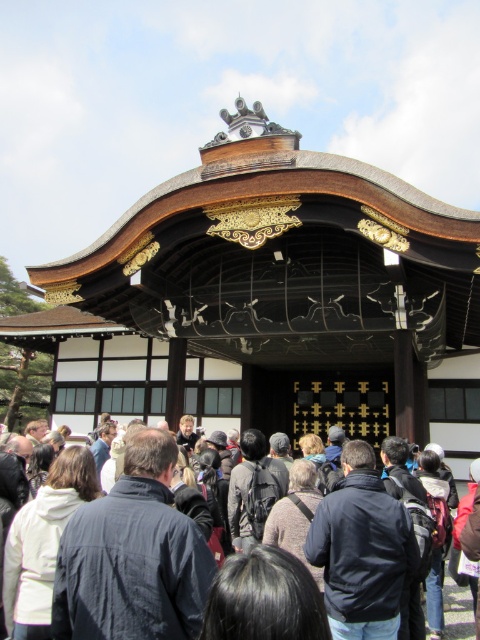
Which is more to the right, dark gray backpack at center or dark blue fabric backpack at center?

dark blue fabric backpack at center

Is point (255, 448) less distant than point (468, 540)?

No, (255, 448) is behind (468, 540).

What do you see at coordinates (252, 490) in the screenshot? I see `dark gray backpack at center` at bounding box center [252, 490].

You are a GUI agent. You are given a task and a screenshot of the screen. Output one action in this format:
    pyautogui.click(x=<x>, y=<y>)
    Task: Click on the dark gray backpack at center
    This screenshot has height=640, width=480.
    Given the screenshot: What is the action you would take?
    pyautogui.click(x=252, y=490)

Consider the image. Who is more distant from viewer, (63, 520) or (477, 529)?

The point (477, 529) is more distant.

Is white fleece jacket at lower left positioned behind dark blue fabric backpack at center?

No, white fleece jacket at lower left is closer to the viewer.

Locate an element on the screen. The height and width of the screenshot is (640, 480). white fleece jacket at lower left is located at coordinates (43, 541).

Is point (181, 588) positioned before point (307, 518)?

Yes.

Is dark blue fabric at center shorter than knitted sweater at center?

Incorrect, dark blue fabric at center's height does not fall short of knitted sweater at center's.

Locate an element on the screen. The width and height of the screenshot is (480, 640). dark blue fabric at center is located at coordinates (132, 556).